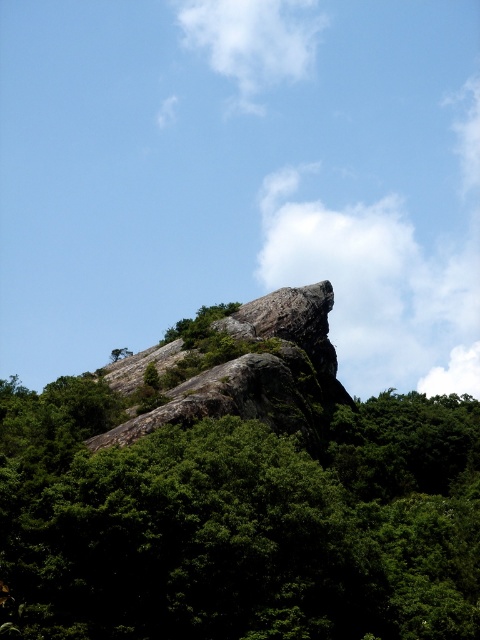
Is green leafy tree at center in front of rough granite rock at center?

Yes, it is.

Identify the location of green leafy tree at center. This screenshot has width=480, height=640. click(239, 522).

Which is below, rough granite rock at center or white fluffy cloud at upper center?

rough granite rock at center

Does rough granite rock at center have a lesser width compared to white fluffy cloud at upper center?

Correct, rough granite rock at center's width is less than white fluffy cloud at upper center's.

Between point (168, 392) and point (317, 29), which one is positioned in front?

Point (168, 392)

Locate an element on the screen. The width and height of the screenshot is (480, 640). rough granite rock at center is located at coordinates (259, 372).

Does green leafy tree at center have a lesser width compared to white fluffy cloud at upper center?

No.

Is green leafy tree at center further to camera compared to white fluffy cloud at upper center?

No.

Identify the location of green leafy tree at center. (239, 522).

You are a GUI agent. You are given a task and a screenshot of the screen. Output one action in this format:
    pyautogui.click(x=<x>, y=<y>)
    Task: Click on the green leafy tree at center
    
    Given the screenshot: What is the action you would take?
    pyautogui.click(x=239, y=522)